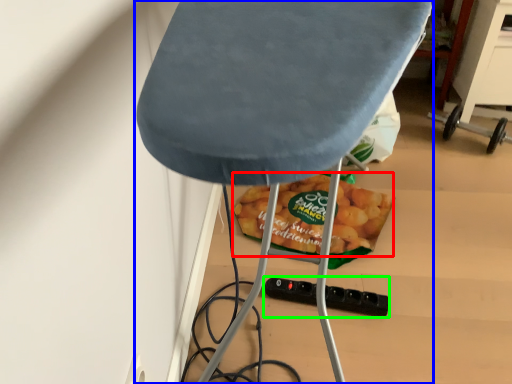
Question: Based on their relative distances, which object is farther from snack (highlighted by a red box)? Choose from furniture (highlighted by a blue box) and socket (highlighted by a green box).

Choices:
 (A) furniture
 (B) socket

Answer: (A)